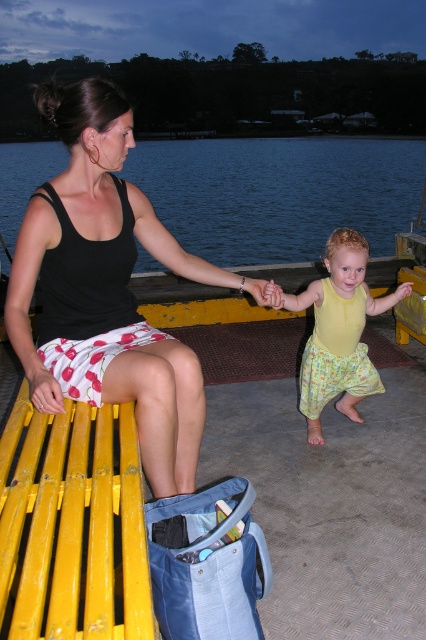
Does blue water at upper center appear over yellow fabric pants at lower right?

Yes.

Is blue water at upper center to the left of yellow fabric pants at lower right from the viewer's perspective?

Indeed, blue water at upper center is positioned on the left side of yellow fabric pants at lower right.

Find the location of a particular element. The image size is (426, 640). blue water at upper center is located at coordinates click(x=279, y=193).

Does point (46, 248) come in front of point (367, 312)?

That is True.

Does black matte tank top at left have a greater height compared to yellow fabric pants at lower right?

Indeed, black matte tank top at left has a greater height compared to yellow fabric pants at lower right.

The image size is (426, 640). I want to click on black matte tank top at left, so click(x=106, y=289).

Who is lower down, black matte tank top at left or blue water at upper center?

black matte tank top at left is below.

What do you see at coordinates (106, 289) in the screenshot? I see `black matte tank top at left` at bounding box center [106, 289].

In order to click on black matte tank top at left in this screenshot , I will do `click(106, 289)`.